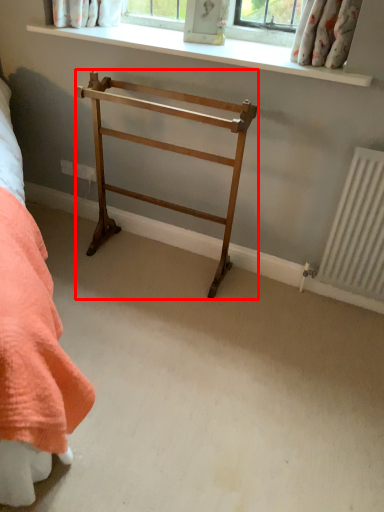
Question: In this image, where is furniture (annotated by the red box) located relative to window sill?

Choices:
 (A) left
 (B) right

Answer: (A)